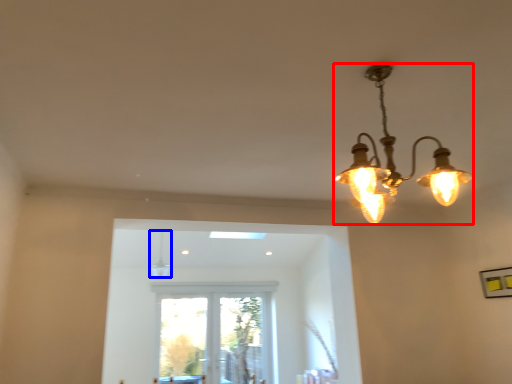
Question: Among these objects, which one is nearest to the camera, lamp (highlighted by a red box) or lamp (highlighted by a blue box)?

Choices:
 (A) lamp
 (B) lamp

Answer: (A)